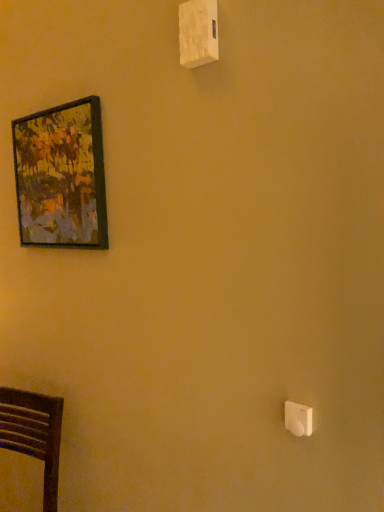
Question: Can you confirm if white plastic light switch at lower right, positioned as the 2th light switch in top-to-bottom order, is smaller than wooden-framed painting at upper left?

Choices:
 (A) no
 (B) yes

Answer: (B)

Question: Does white plastic light switch at lower right, the 1th light switch from the right, appear on the left side of wooden-framed painting at upper left?

Choices:
 (A) yes
 (B) no

Answer: (B)

Question: Can you see white plastic light switch at lower right, marked as the first light switch in a front-to-back arrangement, touching wooden-framed painting at upper left?

Choices:
 (A) no
 (B) yes

Answer: (A)

Question: Is white plastic light switch at lower right, arranged as the first light switch when ordered from the bottom, thinner than wooden-framed painting at upper left?

Choices:
 (A) no
 (B) yes

Answer: (B)

Question: Is white plastic light switch at lower right, arranged as the first light switch when ordered from the bottom, taller than wooden-framed painting at upper left?

Choices:
 (A) yes
 (B) no

Answer: (B)

Question: Can you confirm if white plastic light switch at lower right, the 1th light switch from the right, is shorter than wooden-framed painting at upper left?

Choices:
 (A) yes
 (B) no

Answer: (A)

Question: Is white plastic light switch at lower right, positioned as the 2th light switch in top-to-bottom order, positioned before white plastic light switch at upper center, marked as the 1th light switch in a top-to-bottom arrangement?

Choices:
 (A) yes
 (B) no

Answer: (A)

Question: Considering the relative sizes of white plastic light switch at lower right, the 1th light switch from the right, and white plastic light switch at upper center, placed as the second light switch when sorted from front to back, in the image provided, is white plastic light switch at lower right, the 1th light switch from the right, smaller than white plastic light switch at upper center, placed as the second light switch when sorted from front to back,?

Choices:
 (A) no
 (B) yes

Answer: (B)

Question: From the image's perspective, is white plastic light switch at lower right, arranged as the first light switch when ordered from the bottom, beneath white plastic light switch at upper center, marked as the 1th light switch in a top-to-bottom arrangement?

Choices:
 (A) no
 (B) yes

Answer: (B)

Question: Is white plastic light switch at upper center, which appears as the second light switch when ordered from the bottom, a part of white plastic light switch at lower right, which appears as the 2th light switch when viewed from the left?

Choices:
 (A) yes
 (B) no

Answer: (B)

Question: Is white plastic light switch at lower right, which appears as the 2th light switch when viewed from the left, further to camera compared to white plastic light switch at upper center, which is the 1th light switch in back-to-front order?

Choices:
 (A) yes
 (B) no

Answer: (B)

Question: From a real-world perspective, is white plastic light switch at lower right, the 1th light switch from the right, located beneath white plastic light switch at upper center, marked as the 1th light switch in a top-to-bottom arrangement?

Choices:
 (A) yes
 (B) no

Answer: (A)

Question: Does white plastic light switch at lower right, which appears as the 2th light switch when viewed from the left, have a lesser height compared to dark wood chair at lower left?

Choices:
 (A) no
 (B) yes

Answer: (B)